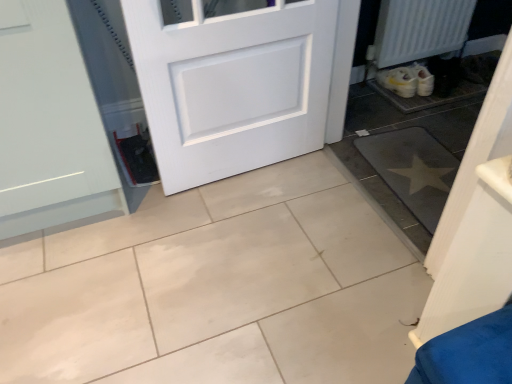
Question: From the image's perspective, is gray matte mat at lower right, marked as the 2th ceramic tile in a left-to-right arrangement, located beneath white glossy tile at center, which is the second ceramic tile from right to left?

Choices:
 (A) yes
 (B) no

Answer: (B)

Question: Can you confirm if gray matte mat at lower right, marked as the 1th ceramic tile in a right-to-left arrangement, is thinner than white glossy tile at center, acting as the first ceramic tile starting from the left?

Choices:
 (A) no
 (B) yes

Answer: (B)

Question: Is gray matte mat at lower right, marked as the 2th ceramic tile in a left-to-right arrangement, at the right side of white glossy tile at center, acting as the first ceramic tile starting from the left?

Choices:
 (A) no
 (B) yes

Answer: (B)

Question: Is gray matte mat at lower right, marked as the 1th ceramic tile in a right-to-left arrangement, facing away from white glossy tile at center, which is the second ceramic tile from right to left?

Choices:
 (A) yes
 (B) no

Answer: (B)

Question: Is gray matte mat at lower right, marked as the 1th ceramic tile in a right-to-left arrangement, completely or partially outside of white glossy tile at center, which is the second ceramic tile from right to left?

Choices:
 (A) no
 (B) yes

Answer: (B)

Question: Choose the correct answer: Is white textured radiator at lower right inside gray matte mat at lower right, marked as the 1th ceramic tile in a right-to-left arrangement, or outside it?

Choices:
 (A) outside
 (B) inside

Answer: (A)

Question: Considering their positions, is white textured radiator at lower right located in front of or behind gray matte mat at lower right, marked as the 1th ceramic tile in a right-to-left arrangement?

Choices:
 (A) front
 (B) behind

Answer: (B)

Question: Based on their positions, is white textured radiator at lower right located to the left or right of gray matte mat at lower right, marked as the 2th ceramic tile in a left-to-right arrangement?

Choices:
 (A) right
 (B) left

Answer: (A)

Question: Considering the positions of white textured radiator at lower right and gray matte mat at lower right, marked as the 1th ceramic tile in a right-to-left arrangement, in the image, is white textured radiator at lower right taller or shorter than gray matte mat at lower right, marked as the 1th ceramic tile in a right-to-left arrangement,?

Choices:
 (A) short
 (B) tall

Answer: (B)

Question: From their relative heights in the image, would you say white textured radiator at lower right is taller or shorter than white matte door at center?

Choices:
 (A) tall
 (B) short

Answer: (B)

Question: In the image, is white textured radiator at lower right on the left side or the right side of white matte door at center?

Choices:
 (A) left
 (B) right

Answer: (B)

Question: Looking at the image, does white textured radiator at lower right seem bigger or smaller compared to white matte door at center?

Choices:
 (A) big
 (B) small

Answer: (B)

Question: From the image's perspective, is white textured radiator at lower right located above or below white matte door at center?

Choices:
 (A) below
 (B) above

Answer: (B)

Question: Is white glossy tile at center, which is the second ceramic tile from right to left, spatially inside white textured radiator at lower right, or outside of it?

Choices:
 (A) inside
 (B) outside

Answer: (B)

Question: Is point 309,342 positioned closer to the camera than point 395,54?

Choices:
 (A) farther
 (B) closer

Answer: (B)